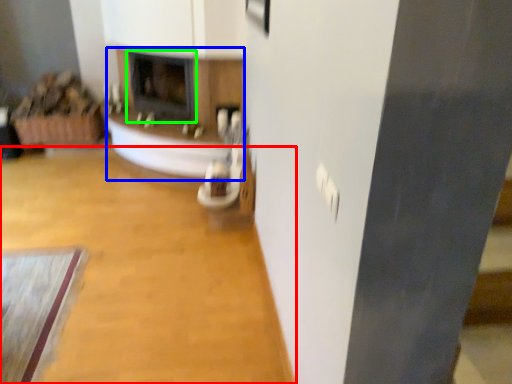
Question: Considering the real-world distances, which object is farthest from plain (highlighted by a red box)? fireplace (highlighted by a blue box) or fireplace (highlighted by a green box)?

Choices:
 (A) fireplace
 (B) fireplace

Answer: (B)